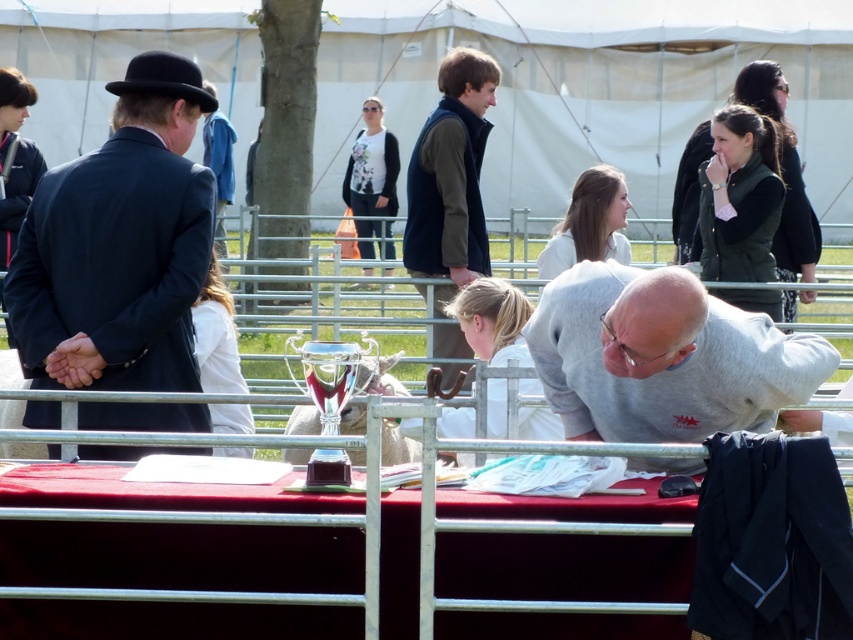
Question: Which of the following is the closest to the observer?

Choices:
 (A) dark green vest at center
 (B) white glossy trophy at center

Answer: (B)

Question: Which point is farther from the camera taking this photo?

Choices:
 (A) (521, 70)
 (B) (381, 381)

Answer: (A)

Question: Can you confirm if matte black bowler hat at left is positioned above white floral shirt at center?

Choices:
 (A) yes
 (B) no

Answer: (B)

Question: Is matte black bowler hat at left thinner than dark green vest at center?

Choices:
 (A) no
 (B) yes

Answer: (A)

Question: Which point appears farthest from the camera in this image?

Choices:
 (A) (421, 253)
 (B) (361, 132)

Answer: (B)

Question: Is dark green vest at center below shiny silver trophy at center?

Choices:
 (A) no
 (B) yes

Answer: (A)